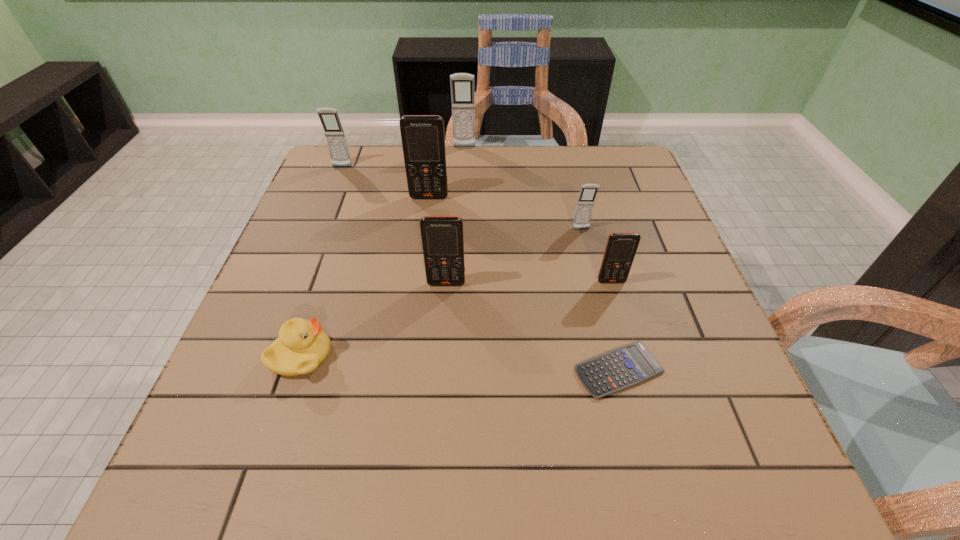
Where is `yellow duckling`? This screenshot has width=960, height=540. yellow duckling is located at coordinates (302, 346).

Locate an element on the screen. The width and height of the screenshot is (960, 540). the second shortest object is located at coordinates (302, 346).

Find the location of a particular element. The height and width of the screenshot is (540, 960). the shortest object is located at coordinates (621, 368).

What are the coordinates of `vacant space located on the front-facing side of the second gray cellular telephone from left to right` in the screenshot? It's located at (463, 188).

Locate an element on the screen. Image resolution: width=960 pixels, height=540 pixels. free space located on the screen of the third farthest object is located at coordinates (424, 233).

Where is `vacant region located on the front-facing side of the fifth nearest cellular telephone`? This screenshot has width=960, height=540. vacant region located on the front-facing side of the fifth nearest cellular telephone is located at coordinates (334, 187).

Where is `free spot located on the screen of the second smallest orange cellular telephone`? The height and width of the screenshot is (540, 960). free spot located on the screen of the second smallest orange cellular telephone is located at coordinates (444, 325).

The image size is (960, 540). What are the coordinates of `vacant area located on the screen of the smallest orange cellular telephone` in the screenshot? It's located at (665, 472).

Where is `blank space located 0.340m on the front-facing side of the fourth farthest cellular telephone`? Image resolution: width=960 pixels, height=540 pixels. blank space located 0.340m on the front-facing side of the fourth farthest cellular telephone is located at coordinates (611, 349).

Where is `vacant space located 0.160m on the beak of the second shortest object`? This screenshot has width=960, height=540. vacant space located 0.160m on the beak of the second shortest object is located at coordinates (418, 356).